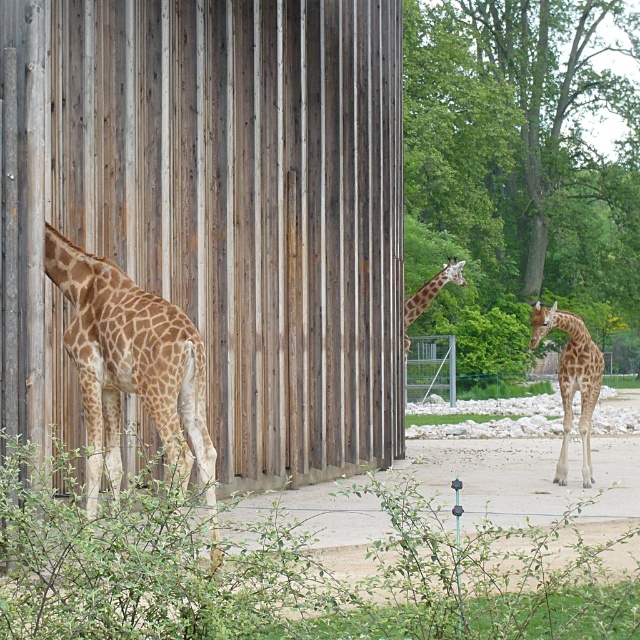
What is the significance of the point at coordinates (x=132, y=368) in the zoo enclosure image?

The point at coordinates (x=132, y=368) marks the location of the spotted fur giraffe at left in the zoo enclosure.

You are a zookeeper trying to feed the spotted fur giraffe at left and the spotted fur giraffe at right. Which giraffe should you approach first to minimize walking distance?

You should approach the spotted fur giraffe at left first because it is closer to you than the spotted fur giraffe at right.